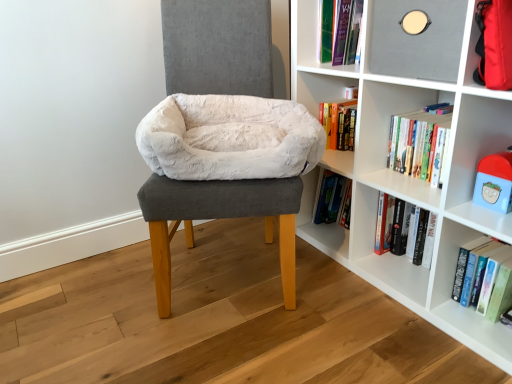
Question: From the image's perspective, relative to white fluffy bean bag at center, is matte gray shelf at upper right above or below?

Choices:
 (A) below
 (B) above

Answer: (B)

Question: Considering the positions of point (428, 46) and point (159, 119), is point (428, 46) closer or farther from the camera than point (159, 119)?

Choices:
 (A) farther
 (B) closer

Answer: (B)

Question: Which of these objects is positioned farthest from the hardcover book at lower right?

Choices:
 (A) white fluffy bean bag at center
 (B) white plush pet bed at center
 (C) white plush toy at upper right
 (D) white matte bookshelf at center
 (E) matte gray shelf at upper right

Answer: (A)

Question: Based on their relative distances, which object is farther from the white matte bookshelf at center?

Choices:
 (A) white plush toy at upper right
 (B) white plush pet bed at center
 (C) matte gray shelf at upper right
 (D) hardcover book at lower right
 (E) white fluffy bean bag at center

Answer: (E)